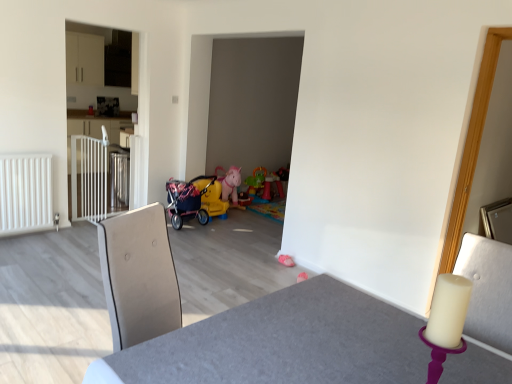
Question: From the image's perspective, would you say white glossy cabinet at left is positioned over white metallic gate at left?

Choices:
 (A) yes
 (B) no

Answer: (A)

Question: Is white glossy cabinet at left surrounding white metallic gate at left?

Choices:
 (A) no
 (B) yes

Answer: (B)

Question: Is white glossy cabinet at left taller than white metallic gate at left?

Choices:
 (A) yes
 (B) no

Answer: (A)

Question: From a real-world perspective, is white glossy cabinet at left located higher than white metallic gate at left?

Choices:
 (A) yes
 (B) no

Answer: (A)

Question: Is white glossy cabinet at left not close to white metallic gate at left?

Choices:
 (A) no
 (B) yes

Answer: (B)

Question: From a real-world perspective, is yellow plastic baby carriage at center physically located above or below smooth gray table at center?

Choices:
 (A) above
 (B) below

Answer: (B)

Question: Is yellow plastic baby carriage at center bigger or smaller than smooth gray table at center?

Choices:
 (A) small
 (B) big

Answer: (A)

Question: Is yellow plastic baby carriage at center taller or shorter than smooth gray table at center?

Choices:
 (A) short
 (B) tall

Answer: (A)

Question: Considering the relative positions of yellow plastic baby carriage at center and smooth gray table at center in the image provided, is yellow plastic baby carriage at center to the left or to the right of smooth gray table at center?

Choices:
 (A) right
 (B) left

Answer: (B)

Question: Is smooth gray table at center taller or shorter than pink fabric toy at lower center, marked as the 2th toy in a back-to-front arrangement?

Choices:
 (A) short
 (B) tall

Answer: (B)

Question: From a real-world perspective, is smooth gray table at center above or below pink fabric toy at lower center, the first toy positioned from the bottom?

Choices:
 (A) below
 (B) above

Answer: (B)

Question: In terms of size, does smooth gray table at center appear bigger or smaller than pink fabric toy at lower center, positioned as the 2th toy in top-to-bottom order?

Choices:
 (A) small
 (B) big

Answer: (B)

Question: Do you think smooth gray table at center is within pink fabric toy at lower center, marked as the 2th toy in a back-to-front arrangement, or outside of it?

Choices:
 (A) outside
 (B) inside

Answer: (A)

Question: Is white glossy cabinet at left bigger or smaller than white matte radiator at left?

Choices:
 (A) big
 (B) small

Answer: (A)

Question: Considering the positions of white glossy cabinet at left and white matte radiator at left in the image, is white glossy cabinet at left taller or shorter than white matte radiator at left?

Choices:
 (A) tall
 (B) short

Answer: (A)